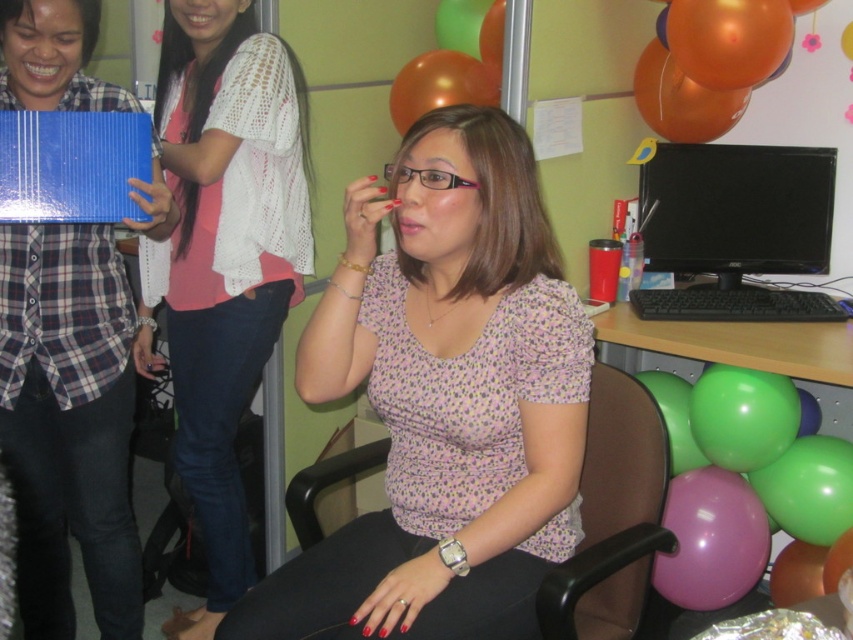
You are standing at the edge of the room and want to hand a gift to the woman in the pink floral blouse at center. The balloons are 1.26 meters away from her. Can you reach her without moving closer than the balloons?

The balloons are 1.26 meters away from the woman in the pink floral blouse at center. Since you are at the edge of the room, you would need to move past the balloons to reach her, so you cannot hand her the gift without moving closer than the balloons.

You are an office assistant who needs to place a new document on the desk. The desk has a black glossy monitor at center and a purple glossy balloon at lower right. Which object should you avoid placing the document near to ensure it doesn not get damaged?

You should avoid placing the document near the black glossy monitor at center because it is much taller than the purple glossy balloon at lower right, so it might cast a shadow or obstruct the document.

You are standing in the office scene and want to move from point A to point B. Point A is at coordinate point (596, 557) and point B is at coordinate point (734, 52). Since you need to walk through the office, will you pass in front of or behind the seated woman?

Point A is in front of point B, so when moving from point A to point B, you would be moving towards the direction of the seated woman. Therefore, you would pass in front of the seated woman.